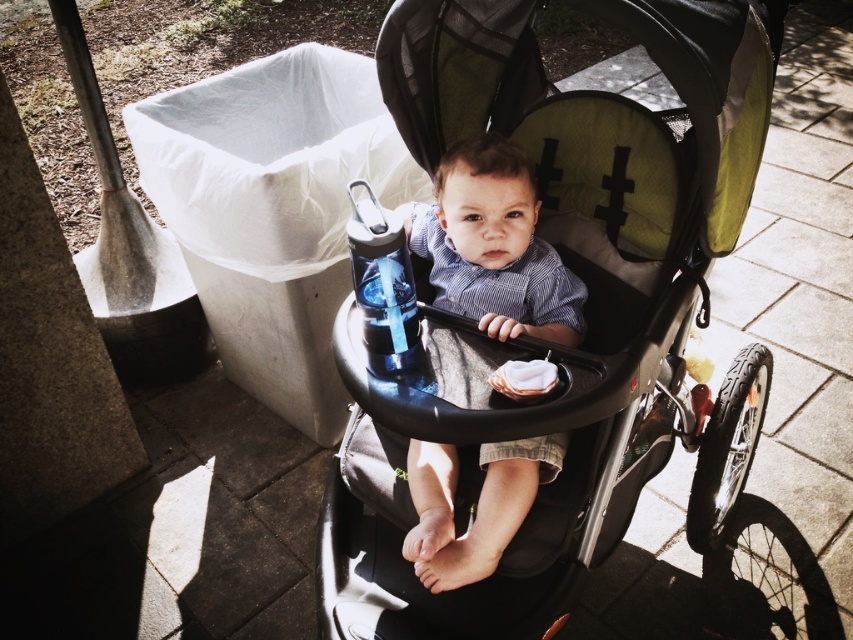
You are a photographer standing 3 feet away from the matte black stroller at center and the matte blue shirt at center. You want to take a photo that includes both objects in focus. Given that your camera has a depth of field that can sharply capture objects within a 8.5 inch range, will both objects be in focus?

The matte black stroller at center and matte blue shirt at center are 9.00 inches apart. Since the camera can only sharply capture objects within an 8.5 inch range, the distance between them exceeds this limit. Therefore, both objects cannot be in focus simultaneously.

You are a photographer setting up for a baby photoshoot. The baby is wearing a matte blue shirt at center and sitting in a matte black stroller at center. To ensure the shirt is well lit, where should you position the main light source relative to the stroller and shirt?

The matte black stroller at center is positioned under the matte blue shirt at center. To ensure the shirt is well lit, position the main light source above the stroller so that the light can illuminate the shirt effectively without being blocked by the stroller.